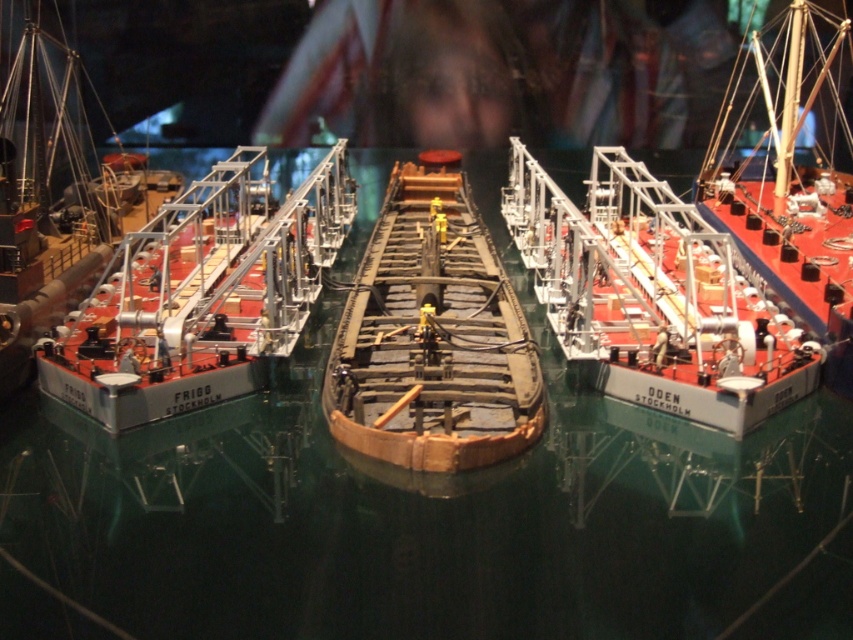
You are a dock worker who needs to secure both the matte brown wooden boat at center and the wooden ship at right. Given that your safety harness can only extend 7 feet, can you safely move between them without needing a longer harness?

The distance between the matte brown wooden boat at center and the wooden ship at right is 8.05 feet, which exceeds the 7 feet limit of your safety harness. Therefore, you cannot safely move between them without a longer harness.

You are a dock worker who needs to move a 1.5 meter long container from the brown wooden boat at center to the wooden ship at right. Can you move it without the container overlapping with either vessel?

The distance between the brown wooden boat at center and the wooden ship at right is 1.63 meters. Since the container is 1.5 meters long, it can be moved between them without overlapping as there is enough space.

You are an observer standing on the dock looking at the two ships. Which ship is shorter in height between the brown wooden boat at center and the wooden ship at right?

The brown wooden boat at center is shorter in height compared to the wooden ship at right.